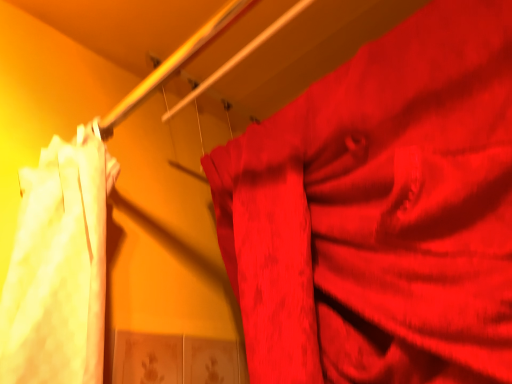
The height and width of the screenshot is (384, 512). Describe the element at coordinates (381, 212) in the screenshot. I see `satin red curtain at right` at that location.

This screenshot has width=512, height=384. Find the location of `satin red curtain at right`. satin red curtain at right is located at coordinates (381, 212).

Measure the distance between satin red curtain at right and camera.

16.43 inches.

Image resolution: width=512 pixels, height=384 pixels. What are the coordinates of `satin red curtain at right` in the screenshot? It's located at (381, 212).